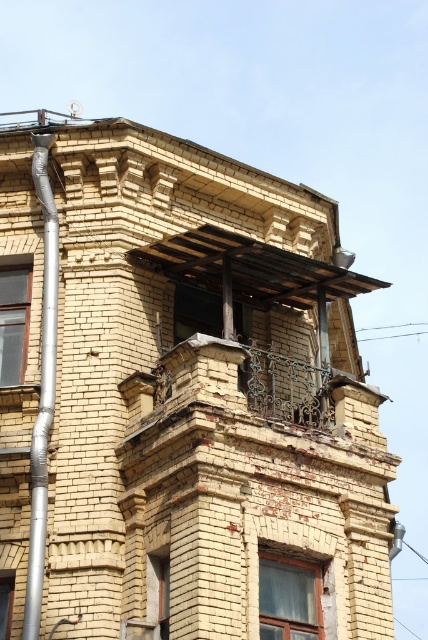
You are an architect reviewing a blueprint of a building. You notice an object labeled silver metallic pipe at left. Can you determine its exact 2D coordinates on the blueprint?

The silver metallic pipe at left is located at the 2D coordinates of point (41, 388).

You are a maintenance worker needing to replace a pipe. You are standing at the silver metallic pipe at left. The nearest ladder is at the matte glass window at center. Can you reach the ladder from your current position without moving? Explain your reasoning.

The silver metallic pipe at left and the matte glass window at center are 24.60 feet apart. Since the distance between them is over 24 feet, you cannot reach the ladder at the matte glass window at center from the silver metallic pipe at left without moving closer.

You are a maintenance worker inspecting the building. You notice the silver metallic pipe at left and the clear glass window at left. Which object is positioned lower in the structure?

The silver metallic pipe at left is below the clear glass window at left, so the silver metallic pipe at left is positioned lower in the structure.